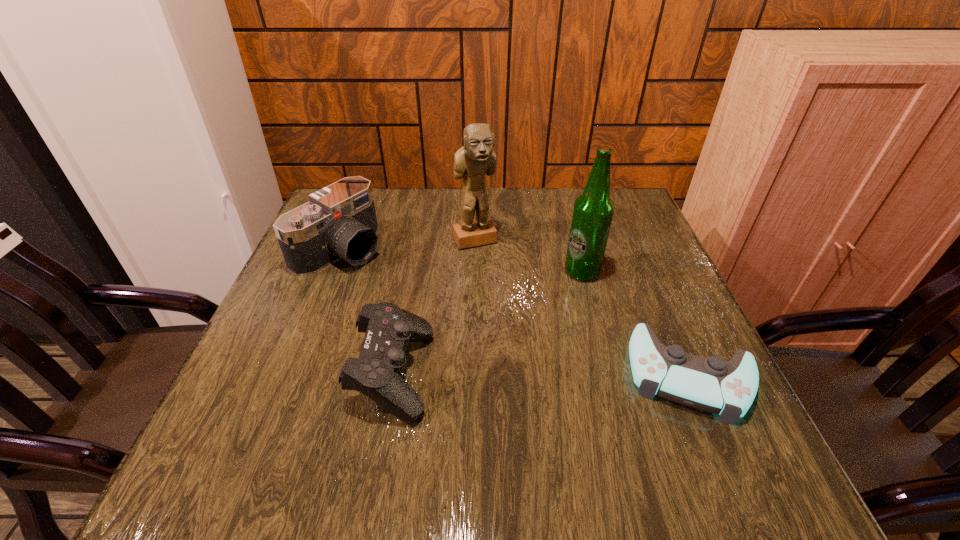
I want to click on figurine at the far edge, so click(474, 160).

Where is `object that is positioned at the left edge`? The image size is (960, 540). object that is positioned at the left edge is located at coordinates (339, 222).

The height and width of the screenshot is (540, 960). I want to click on object at the right edge, so click(x=710, y=384).

I want to click on object present at the far left corner, so click(339, 222).

Find the location of a particular element. This screenshot has width=960, height=540. object located in the near right corner section of the desktop is located at coordinates (710, 384).

Identify the location of vacant space at the far edge of the desktop. The width and height of the screenshot is (960, 540). (495, 224).

In the image, there is a desktop. At what (x,y) coordinates should I click in order to perform the action: click on vacant space at the near edge. Please return your answer as a coordinate pair (x, y). The width and height of the screenshot is (960, 540). Looking at the image, I should click on (521, 403).

The width and height of the screenshot is (960, 540). In the image, there is a desktop. Identify the location of blank space at the left edge. (275, 384).

The image size is (960, 540). Find the location of `vacant area at the right edge of the desktop`. vacant area at the right edge of the desktop is located at coordinates (670, 299).

The width and height of the screenshot is (960, 540). Find the location of `free space at the far left corner of the desktop`. free space at the far left corner of the desktop is located at coordinates (378, 198).